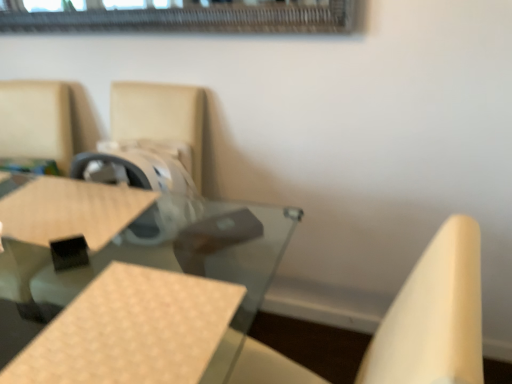
Question: From their relative heights in the image, would you say beige woven plywood at center is taller or shorter than clear glass table at center?

Choices:
 (A) tall
 (B) short

Answer: (B)

Question: Is point (31, 367) positioned closer to the camera than point (172, 301)?

Choices:
 (A) closer
 (B) farther

Answer: (A)

Question: Considering the real-world distances, which object is farthest from the clear glass table at center?

Choices:
 (A) beige woven plywood at center
 (B) matte brown chair at upper left

Answer: (A)

Question: Estimate the real-world distances between objects in this image. Which object is farther from the beige woven plywood at center?

Choices:
 (A) matte brown chair at upper left
 (B) clear glass table at center

Answer: (A)